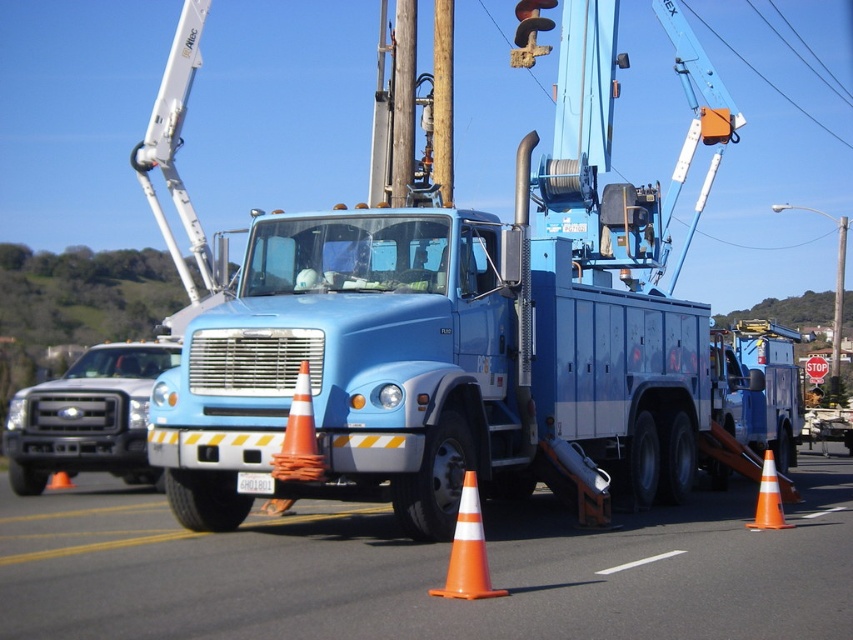
You are a delivery driver who needs to pass by the brushed metal truck at left. The road you are on is 12 meters wide. Can you safely navigate around the truck without crossing the center line?

The brushed metal truck at left is 11.16 meters from the camera. Since the road is 12 meters wide, there is 0.84 meters of space remaining on the opposite side of the road. This narrow space may allow passage but requires careful maneuvering to avoid crossing the center line.

You are standing at the point marked by the orange cone at lower center represented by point (468, 550). The utility truck is parked on the road. In which direction should you walk to avoid the truck?

The orange cone at lower center represented by point (468, 550) is located near the utility truck. To avoid the truck, you should walk away from the truck in the direction opposite to where the truck is parked.